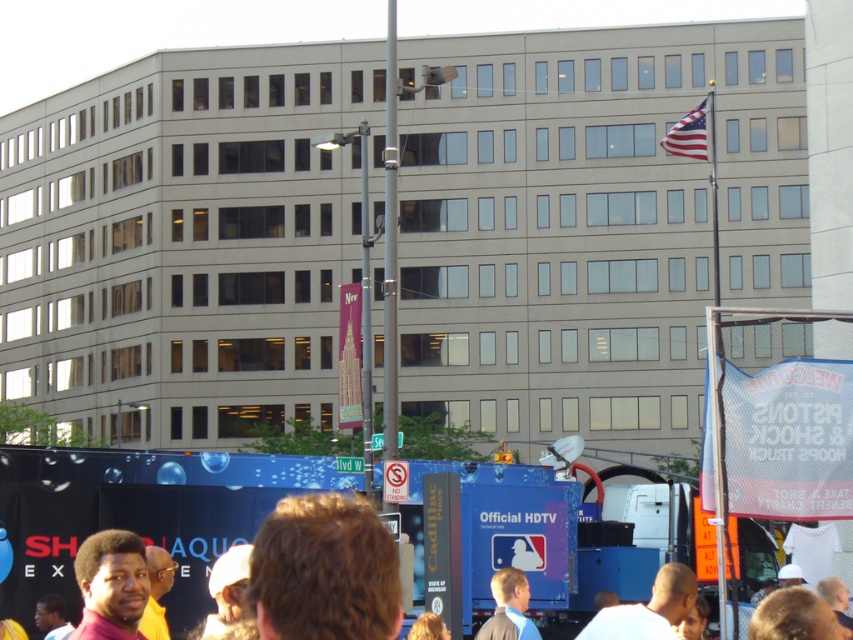
In the scene shown: Measure the distance between brown curly hair at lower center and camera.

brown curly hair at lower center is 13.87 feet away from camera.

Does brown curly hair at lower center come behind blonde hair at lower right?

No, brown curly hair at lower center is in front of blonde hair at lower right.

This screenshot has height=640, width=853. Find the location of `brown curly hair at lower center`. brown curly hair at lower center is located at coordinates (323, 572).

Is brown curly hair at lower center smaller than white fabric turban at lower center?

Yes.

Is brown curly hair at lower center further to camera compared to white fabric turban at lower center?

No, brown curly hair at lower center is closer to the viewer.

Does point (303, 532) come farther from viewer compared to point (223, 604)?

No, it is in front of (223, 604).

Locate an element on the screen. The image size is (853, 640). brown curly hair at lower center is located at coordinates (323, 572).

Does blonde hair at lower right have a lesser width compared to light brown suit at center?

Correct, blonde hair at lower right's width is less than light brown suit at center's.

Does blonde hair at lower right have a smaller size compared to light brown suit at center?

Correct, blonde hair at lower right occupies less space than light brown suit at center.

Who is more distant from viewer, (756,621) or (503,596)?

Point (503,596)

Find the location of a particular element. Image resolution: width=853 pixels, height=640 pixels. blonde hair at lower right is located at coordinates (793, 618).